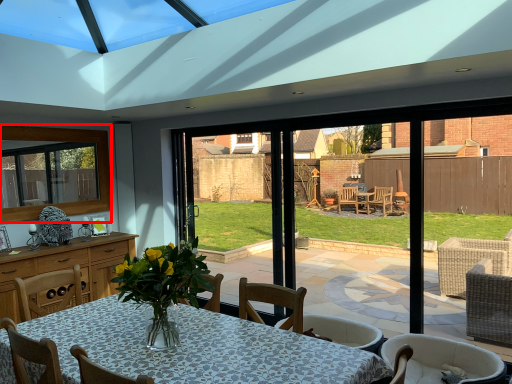
Question: From the image's perspective, where is window (annotated by the red box) located relative to chair?

Choices:
 (A) above
 (B) below

Answer: (A)